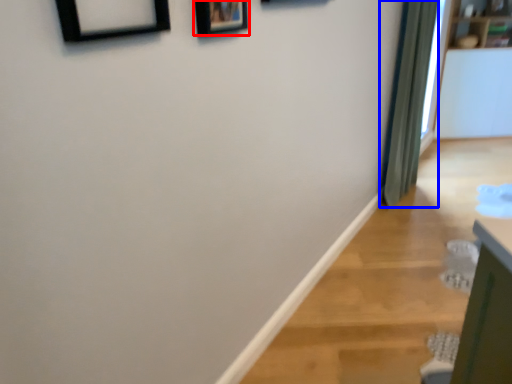
Question: Which object appears closest to the camera in this image, picture frame (highlighted by a red box) or curtain (highlighted by a blue box)?

Choices:
 (A) picture frame
 (B) curtain

Answer: (A)